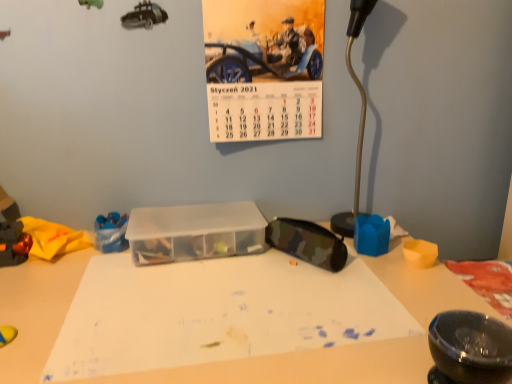
Question: Can you confirm if shiny metallic toy car at left, the third toy from the right, is wider than metallic silver lamp at right?

Choices:
 (A) no
 (B) yes

Answer: (B)

Question: Is the depth of shiny metallic toy car at left, the third toy from the right, less than that of metallic silver lamp at right?

Choices:
 (A) yes
 (B) no

Answer: (B)

Question: Is the surface of shiny metallic toy car at left, the first toy in the left-to-right sequence, in direct contact with metallic silver lamp at right?

Choices:
 (A) yes
 (B) no

Answer: (B)

Question: Is shiny metallic toy car at left, the first toy in the left-to-right sequence, not inside metallic silver lamp at right?

Choices:
 (A) yes
 (B) no

Answer: (A)

Question: From the image's perspective, would you say shiny metallic toy car at left, the third toy from the right, is shown under metallic silver lamp at right?

Choices:
 (A) no
 (B) yes

Answer: (B)

Question: Would you say transparent plastic container at center is part of camo fabric pouch at center-right's contents?

Choices:
 (A) no
 (B) yes

Answer: (A)

Question: Is camo fabric pouch at center-right taller than transparent plastic container at center?

Choices:
 (A) yes
 (B) no

Answer: (A)

Question: Is camo fabric pouch at center-right positioned before transparent plastic container at center?

Choices:
 (A) no
 (B) yes

Answer: (B)

Question: Is camo fabric pouch at center-right at the left side of transparent plastic container at center?

Choices:
 (A) yes
 (B) no

Answer: (B)

Question: Could you tell me if camo fabric pouch at center-right is turned towards transparent plastic container at center?

Choices:
 (A) no
 (B) yes

Answer: (A)

Question: Considering the relative sizes of camo fabric pouch at center-right and transparent plastic container at center in the image provided, is camo fabric pouch at center-right shorter than transparent plastic container at center?

Choices:
 (A) yes
 (B) no

Answer: (B)

Question: Is shiny metallic toy car at left, the first toy in the left-to-right sequence, far from camo fabric pouch at center-right?

Choices:
 (A) yes
 (B) no

Answer: (B)